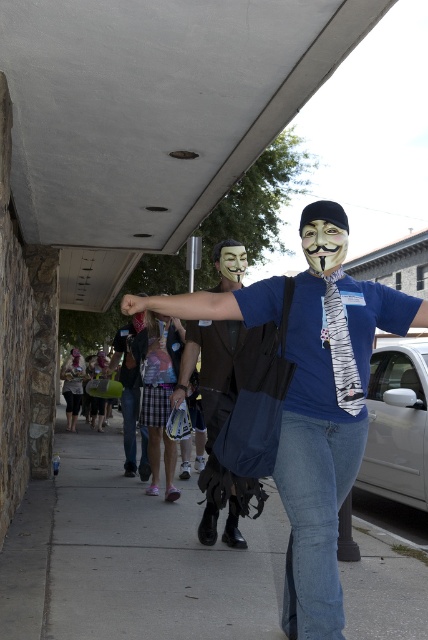
Question: Which of the following is the closest to the observer?

Choices:
 (A) (172, 300)
 (B) (240, 536)
 (C) (317, 256)
 (D) (107, 477)

Answer: (C)

Question: Where is blue fabric shirt at center located in relation to matte white mask at center in the image?

Choices:
 (A) above
 (B) below

Answer: (B)

Question: Is gray concrete sidewalk at lower center in front of matte black mask at center?

Choices:
 (A) no
 (B) yes

Answer: (A)

Question: Which point is closer to the camera?

Choices:
 (A) (318, 260)
 (B) (137, 392)
 (C) (107, 452)

Answer: (A)

Question: Does gray concrete sidewalk at lower center have a smaller size compared to blue fabric shirt at center?

Choices:
 (A) yes
 (B) no

Answer: (A)

Question: Which of the following is the farthest from the observer?

Choices:
 (A) (127, 371)
 (B) (303, 243)
 (C) (243, 262)

Answer: (A)